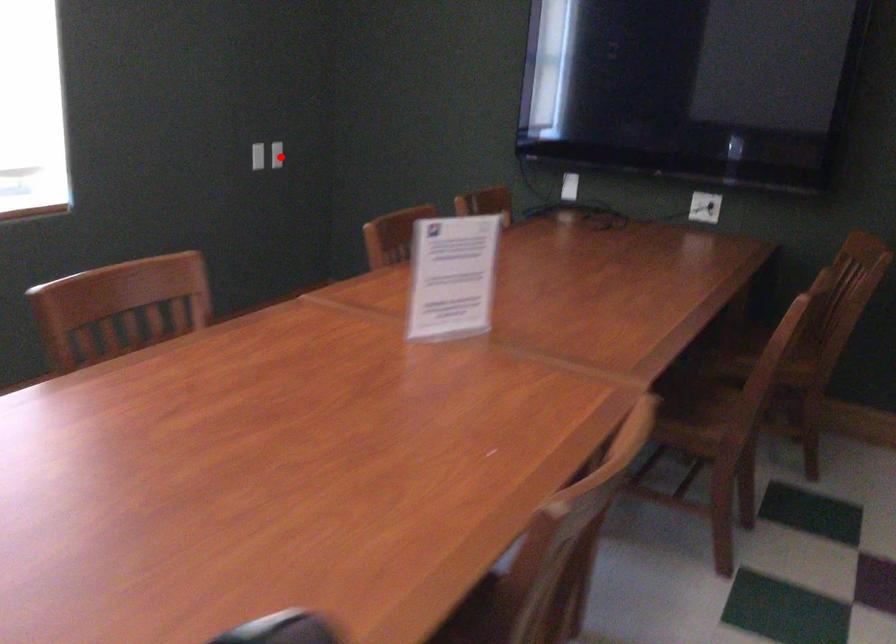
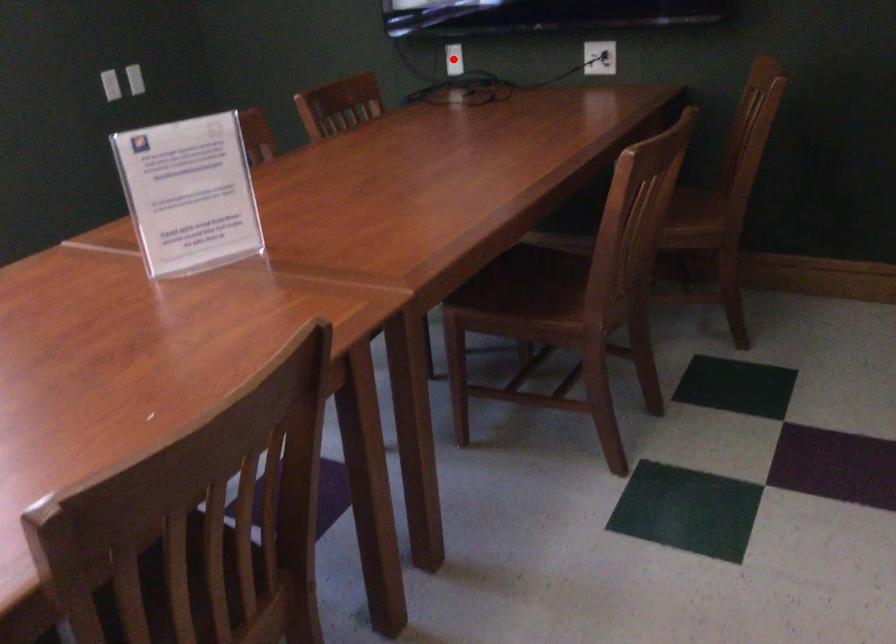
I am providing you with two images of the same scene from different viewpoints. A red point is marked on the first image and another point is marked on the second image. Are the points marked in image1 and image2 representing the same 3D position?

No